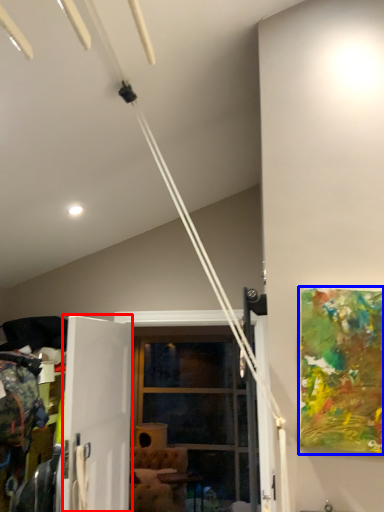
Question: Which object is further to the camera taking this photo, screen door (highlighted by a red box) or picture frame (highlighted by a blue box)?

Choices:
 (A) screen door
 (B) picture frame

Answer: (A)